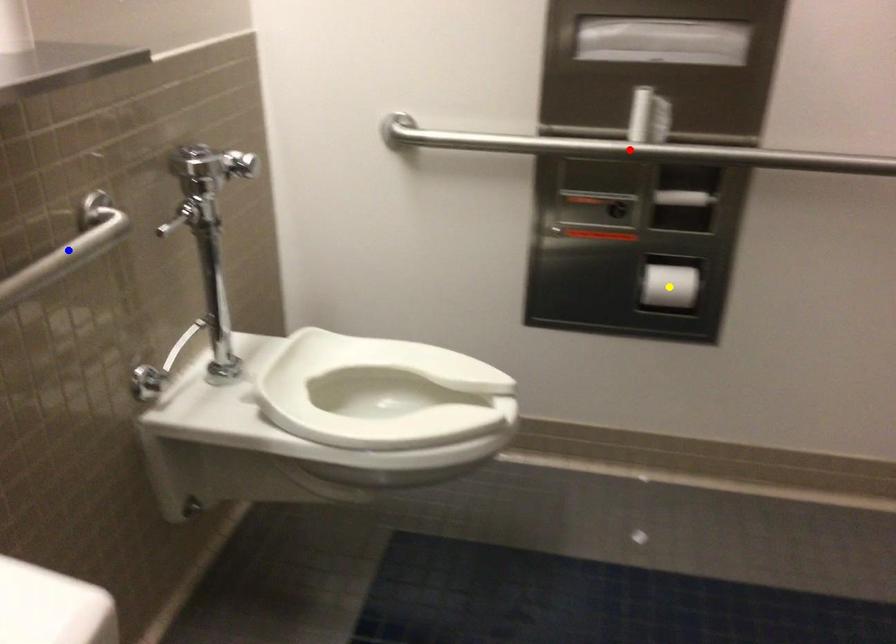
Order these from nearest to farthest:
yellow point
blue point
red point

blue point, red point, yellow point